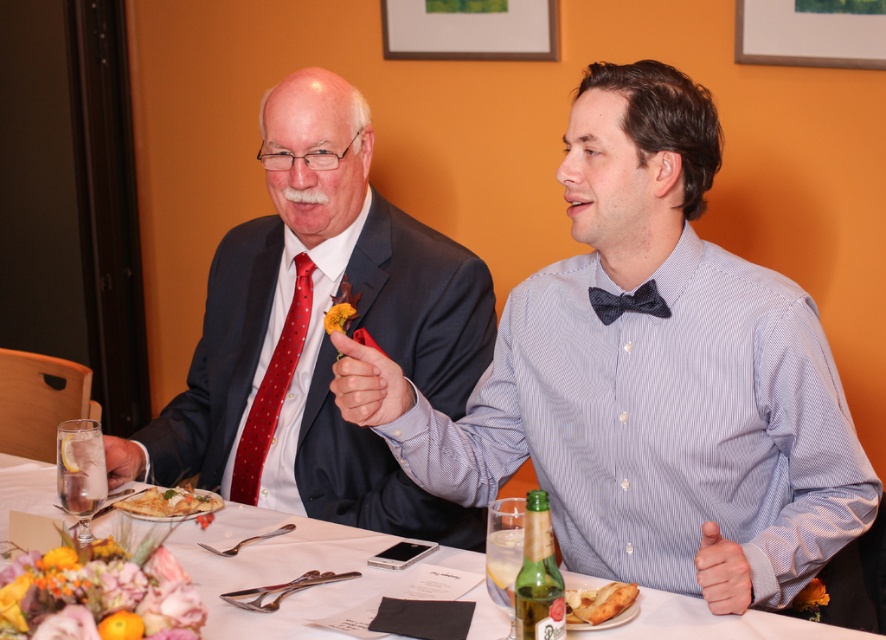
You are a photographer standing behind the dark blue textured bow tie at center and want to take a photo of the white glossy table at center. Is the table within a 30 inch range to ensure clear focus without needing a zoom lens?

The distance between the white glossy table at center and the dark blue textured bow tie at center is 27.86 inches, which is within the 30 inch range. Therefore, the table is close enough for clear focus without needing a zoom lens.

You are a photographer taking a portrait of the two individuals at the table. You want to ensure that both the matte blue shirt at center and the dark blue textured bow tie at center are clearly visible in the frame. Given their sizes, which one might require more careful framing to avoid being too small in the photo?

The matte blue shirt at center is smaller in width than the dark blue textured bow tie at center, so the matte blue shirt at center might require more careful framing to ensure it isn